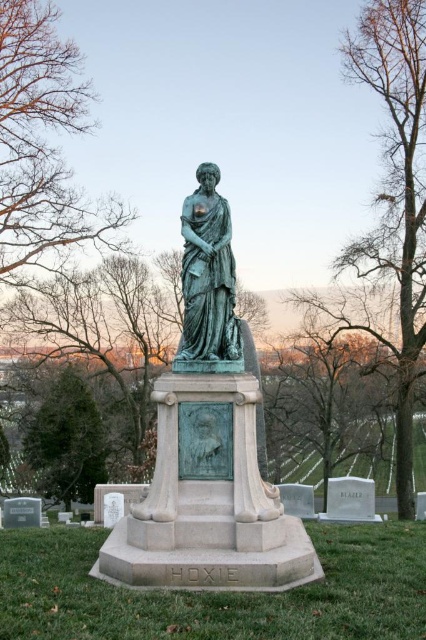
Does point (236, 349) lie in front of point (17, 35)?

Yes.

Is point (267, 518) farther from viewer compared to point (77, 205)?

No, (267, 518) is in front of (77, 205).

Does point (115, 560) come closer to viewer compared to point (72, 220)?

Yes, point (115, 560) is closer to viewer.

Identify the location of green patina statue at center. (209, 444).

Which of these two, green patinated statue at center or green bronze statue at lower left, stands shorter?

green bronze statue at lower left

Looking at this image, who is taller, green patinated statue at center or green bronze statue at lower left?

green patinated statue at center is taller.

Is point (204, 314) farther from viewer compared to point (100, 424)?

That is False.

Identify the location of green patinated statue at center. The height and width of the screenshot is (640, 426). (207, 275).

Does green patina statue at center have a lesser width compared to green patinated statue at center?

No, green patina statue at center is not thinner than green patinated statue at center.

Is green patina statue at center closer to the viewer compared to green patinated statue at center?

That is True.

I want to click on green patina statue at center, so click(x=209, y=444).

At what (x,y) coordinates should I click in order to perform the action: click on green patina statue at center. Please return your answer as a coordinate pair (x, y). Looking at the image, I should click on (209, 444).